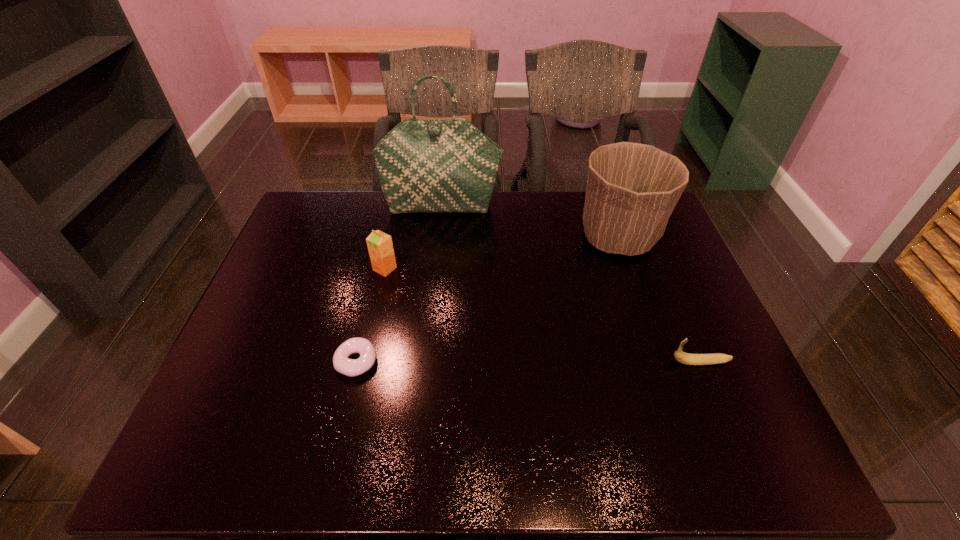
Identify the location of free location located 0.350m at the stem of the fourth tallest object. (524, 362).

Find the location of a particular element. The image size is (960, 540). free location located 0.170m on the left of the doughnut is located at coordinates (264, 362).

Locate an element on the screen. Image resolution: width=960 pixels, height=540 pixels. tote bag that is at the far edge is located at coordinates (448, 165).

Identify the location of flowerpot at the far edge. This screenshot has width=960, height=540. (632, 189).

Find the location of a particular element. This screenshot has height=540, width=960. flowerpot that is positioned at the right edge is located at coordinates (632, 189).

Find the location of `banana that is at the right edge`. banana that is at the right edge is located at coordinates [x=685, y=358].

Locate an element on the screen. object positioned at the far right corner is located at coordinates (632, 189).

You are a GUI agent. You are given a task and a screenshot of the screen. Output one action in this format:
    pyautogui.click(x=<x>, y=<y>)
    Task: Click on the free region at the far edge of the desktop
    
    Given the screenshot: What is the action you would take?
    pyautogui.click(x=507, y=218)

In the image, there is a desktop. Identify the location of vacant space at the left edge. This screenshot has width=960, height=540. 254,382.

The width and height of the screenshot is (960, 540). I want to click on free region at the right edge of the desktop, so click(x=709, y=387).